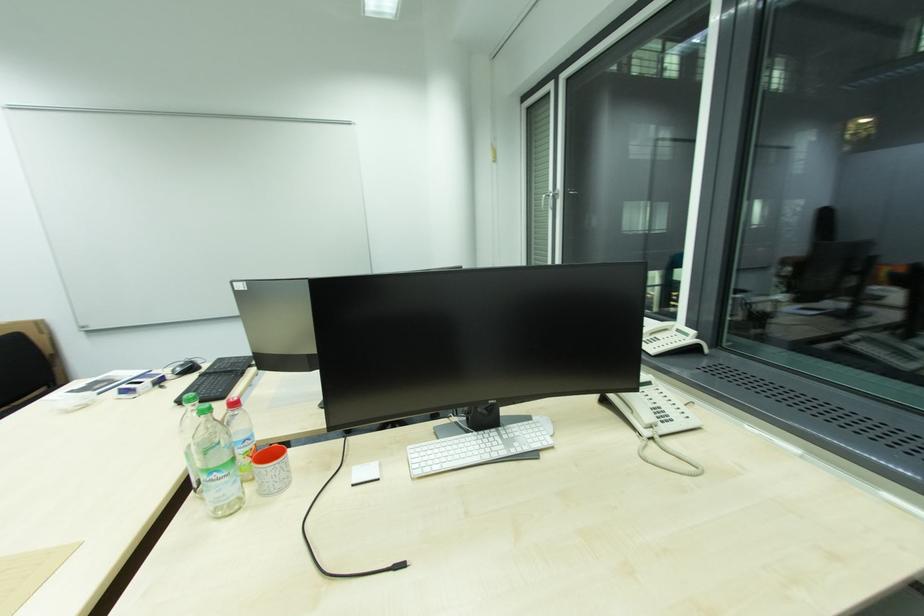
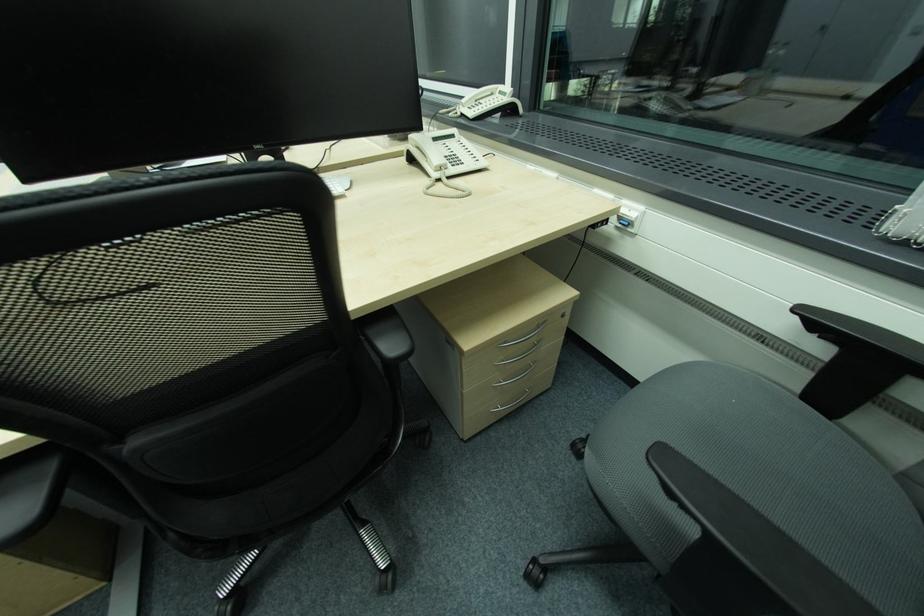
Question: The images are taken continuously from a first-person perspective. In which direction is your viewpoint rotating?

Choices:
 (A) Left
 (B) Right
 (C) Up
 (D) Down

Answer: (D)